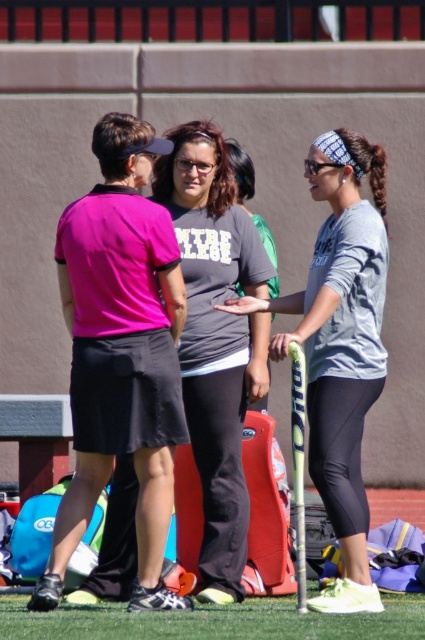
Consider the image. You are a tennis instructor preparing for a lesson. You notice the gray matte tennis racket at center and the green artificial turf at lower center. Which object is taller?

The gray matte tennis racket at center is taller than the green artificial turf at lower center.

You are a photographer positioned at the center of the field. You want to take a photo that includes both the gray matte tennis racket at center and the person on the right. Based on their positions, will the racket block the view of the person on the right in the photo?

The gray matte tennis racket at center is located at point (340, 346), so it might block the view of the person on the right depending on the camera angle and field of view. However, since the racket is at the center and the person is on the right, adjusting the angle slightly could ensure both are visible without obstruction.